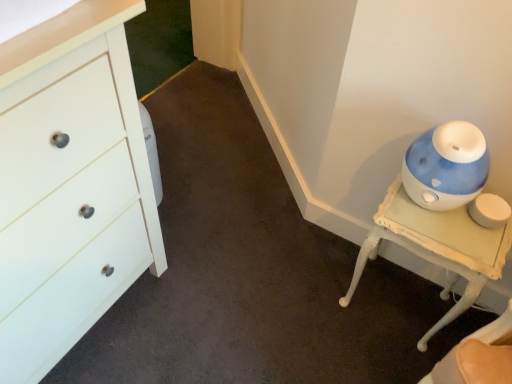
Find the location of `vacant space to the right of white matte chest of drawers at left`. vacant space to the right of white matte chest of drawers at left is located at coordinates (213, 285).